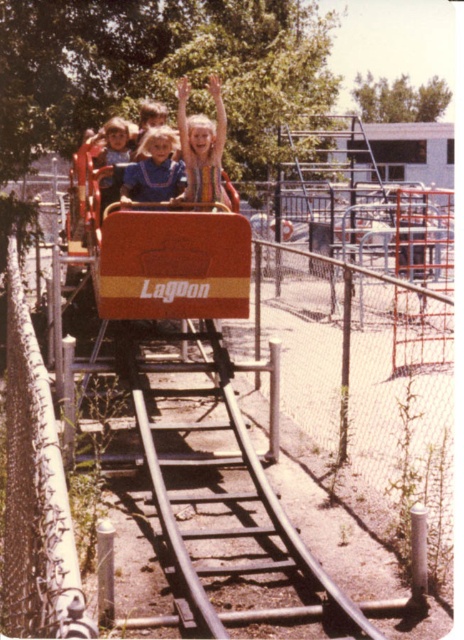
You are standing in front of the roller coaster at Lagoon Amusement Park. You see two points marked on the roller coaster track. The first point is at coordinates point (141,193) and the second point is at point (113,122). Which point is closer to you?

Point (141,193) is closer to the camera than point (113,122).

Looking at this image, you are a photographer trying to capture the striped dress at center. You see a point at coordinates (201, 145). Is this point on the striped dress at center?

Yes, the point at coordinates (201, 145) is on the striped dress at center.

You are standing at the entrance of the roller coaster and want to find the striped dress at center. Which direction should you look to see it?

The striped dress at center is located at point 0.228 on the x axis and 0.435 on the y axis. Since the entrance is at the start of the roller coaster track, you should look towards the center of the image to find the striped dress at center.